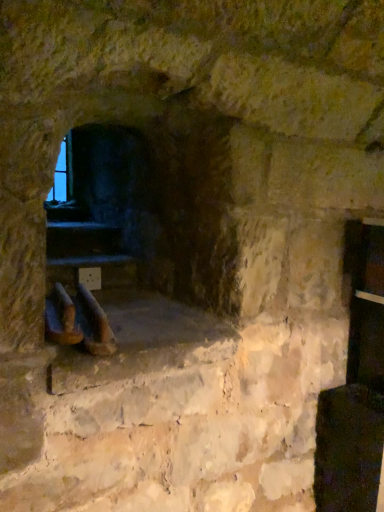
Question: In terms of size, does brown leather boot at center, which is the second footwear from left to right, appear bigger or smaller than dark stone fireplace at center?

Choices:
 (A) big
 (B) small

Answer: (B)

Question: From their relative heights in the image, would you say brown leather boot at center, which is the second footwear from left to right, is taller or shorter than dark stone fireplace at center?

Choices:
 (A) tall
 (B) short

Answer: (B)

Question: Considering the real-world distances, which object is closest to the brown leather boot at lower left, the 1th footwear when ordered from left to right?

Choices:
 (A) dark stone fireplace at center
 (B) brown leather boot at center, which is the second footwear from left to right

Answer: (B)

Question: Estimate the real-world distances between objects in this image. Which object is farther from the brown leather boot at center, which is the second footwear from left to right?

Choices:
 (A) dark stone fireplace at center
 (B) brown leather boot at lower left, marked as the second footwear in a right-to-left arrangement

Answer: (A)